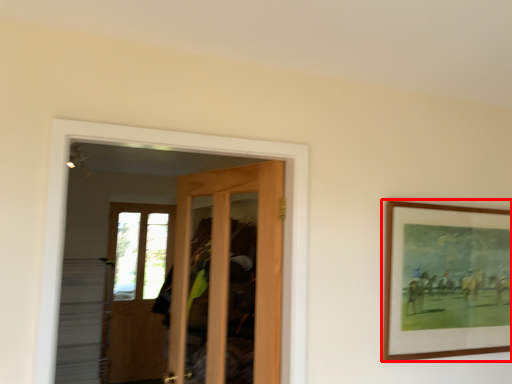
Question: From the image's perspective, where is picture frame (annotated by the red box) located relative to door?

Choices:
 (A) below
 (B) above

Answer: (B)